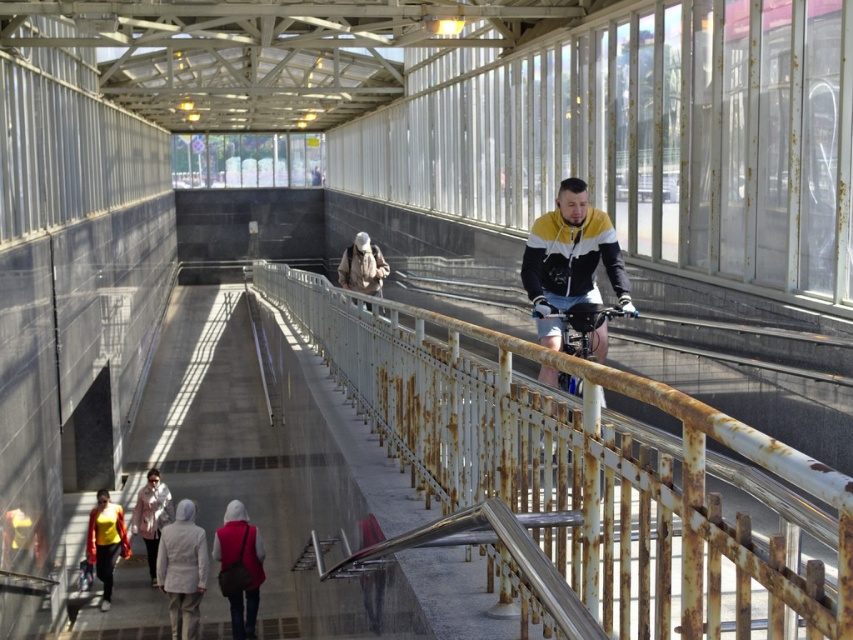
Question: Is matte red jacket at lower center further to camera compared to yellow fabric jacket at lower left?

Choices:
 (A) no
 (B) yes

Answer: (A)

Question: Considering the real-world distances, which object is closest to the light gray fabric jacket at lower center?

Choices:
 (A) camouflage fabric backpack at center
 (B) matte red jacket at lower center
 (C) shiny metallic bicycle at center

Answer: (B)

Question: Estimate the real-world distances between objects in this image. Which object is closer to the matte red jacket at lower center?

Choices:
 (A) yellow fabric jacket at lower left
 (B) rusty metal railing at center
 (C) shiny metallic bicycle at center

Answer: (A)

Question: Can you confirm if rusty metal railing at center is positioned below camouflage fabric backpack at center?

Choices:
 (A) yes
 (B) no

Answer: (A)

Question: Which of the following is the closest to the observer?

Choices:
 (A) yellow-black jacket at center
 (B) yellow fabric jacket at lower left
 (C) white matte jacket at lower left
 (D) rusty metal railing at center

Answer: (D)

Question: Is yellow-black jacket at center smaller than shiny metallic bicycle at center?

Choices:
 (A) yes
 (B) no

Answer: (B)